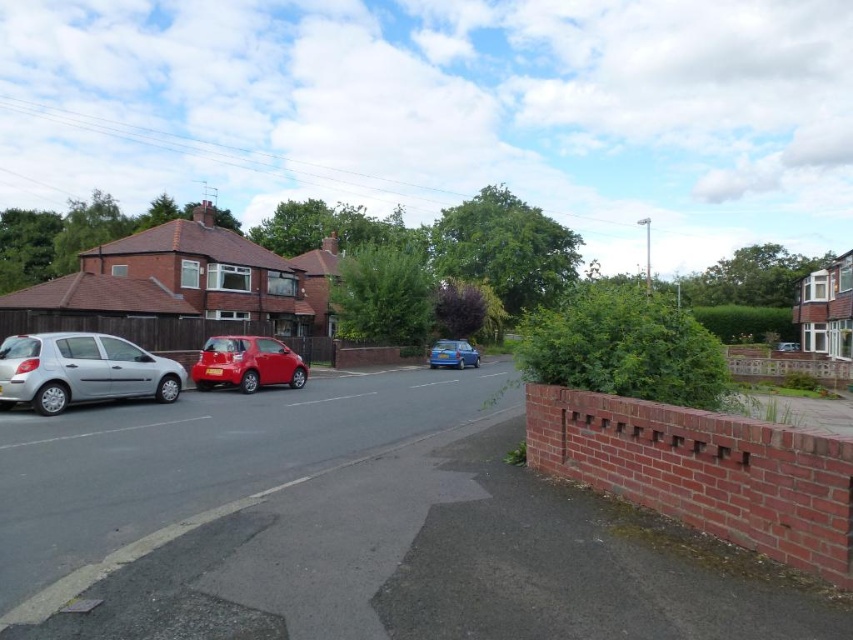
Question: Can you confirm if shiny red car at center is bigger than blue metallic hatchback at center?

Choices:
 (A) no
 (B) yes

Answer: (A)

Question: Which point is farther from the camera taking this photo?

Choices:
 (A) (786, 340)
 (B) (271, 353)
 (C) (61, 349)
 (D) (463, 355)

Answer: (A)

Question: Which of the following is the farthest from the observer?

Choices:
 (A) silver metallic car at left
 (B) blue metallic hatchback at center
 (C) metallic silver car at center
 (D) shiny red car at center

Answer: (C)

Question: Does silver metallic car at left have a larger size compared to blue metallic hatchback at center?

Choices:
 (A) no
 (B) yes

Answer: (A)

Question: Can you confirm if silver metallic car at left is positioned below blue metallic hatchback at center?

Choices:
 (A) yes
 (B) no

Answer: (A)

Question: Among these points, which one is farthest from the camera?

Choices:
 (A) (247, 358)
 (B) (50, 353)
 (C) (463, 355)
 (D) (793, 349)

Answer: (D)